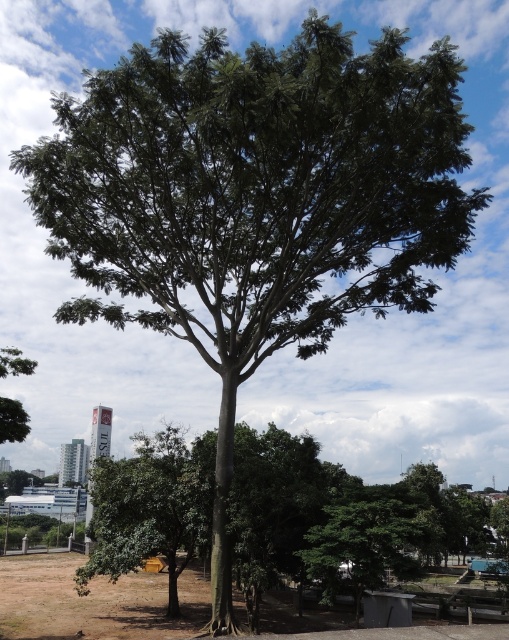
Is green leafy tree at lower center bigger than green leafy tree at left?

Yes, green leafy tree at lower center is bigger than green leafy tree at left.

Can you confirm if green leafy tree at lower center is smaller than green leafy tree at left?

Incorrect, green leafy tree at lower center is not smaller in size than green leafy tree at left.

Locate an element on the screen. This screenshot has height=640, width=509. green leafy tree at lower center is located at coordinates (371, 538).